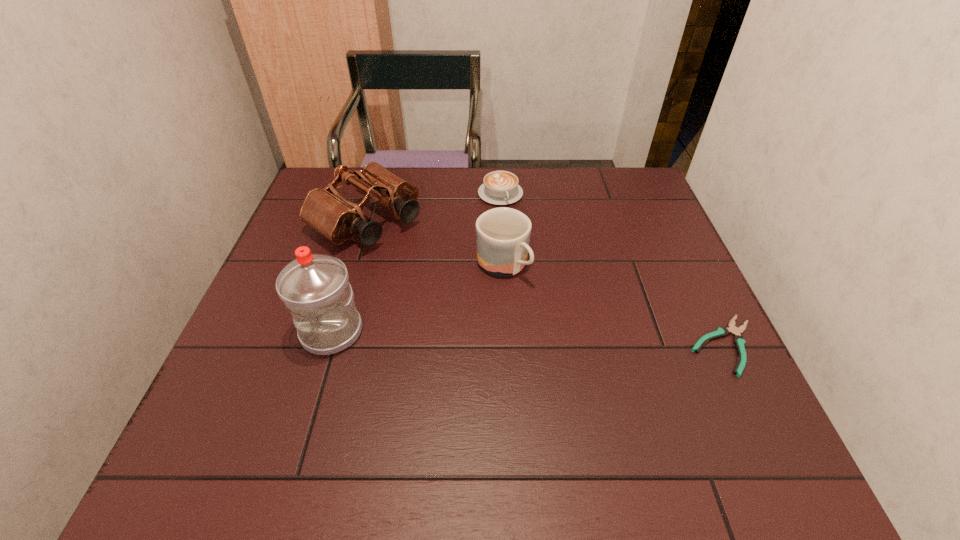
In order to click on free spot on the desktop that is between the water bottle and the pliers and is positioned through the eyepieces of the binoculars in this screenshot , I will do `click(540, 339)`.

Where is `vacant space on the desktop that is between the water bottle and the shortest object and is positioned on the side with the handle of the mug`? The image size is (960, 540). vacant space on the desktop that is between the water bottle and the shortest object and is positioned on the side with the handle of the mug is located at coordinates [x=580, y=340].

Identify the location of free space on the desktop that is between the water bottle and the pliers and is positioned on the side of the cappuccino with the handle. Image resolution: width=960 pixels, height=540 pixels. (581, 341).